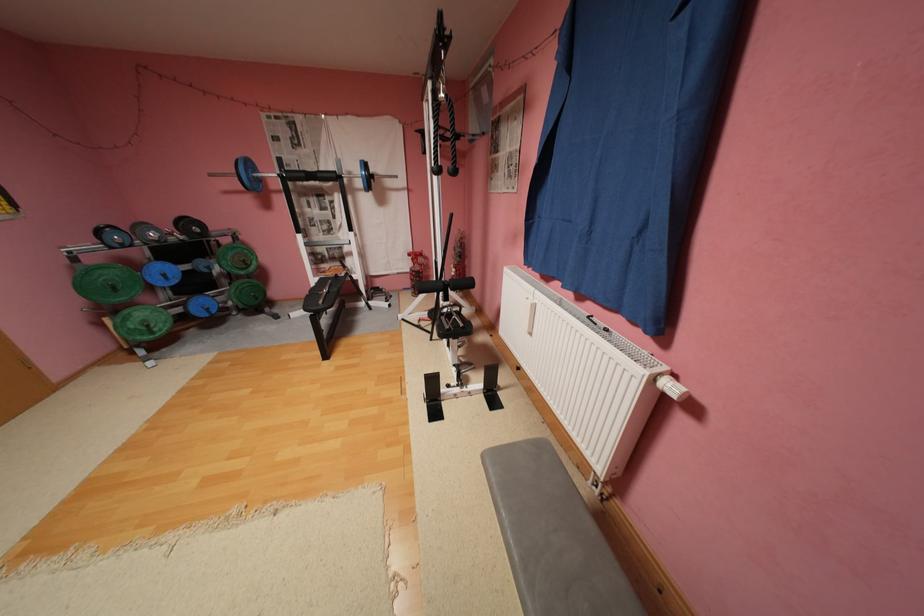
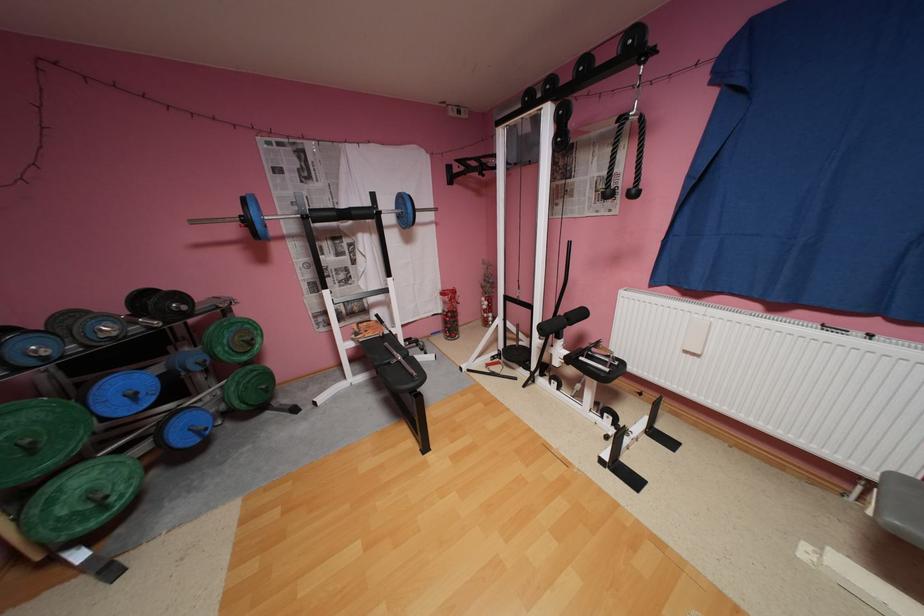
Find the pixel in the second image that matches the point at 162,333 in the first image.

(116, 508)